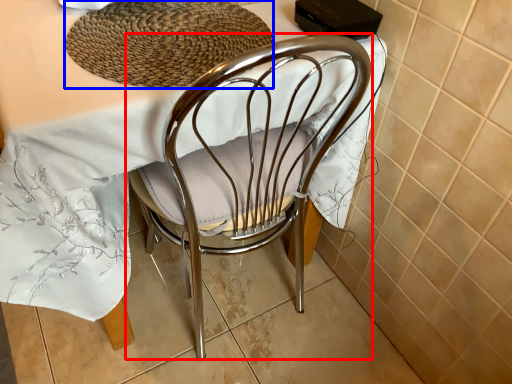
Question: Which object appears closest to the camera in this image, chair (highlighted by a red box) or mat (highlighted by a blue box)?

Choices:
 (A) chair
 (B) mat

Answer: (A)